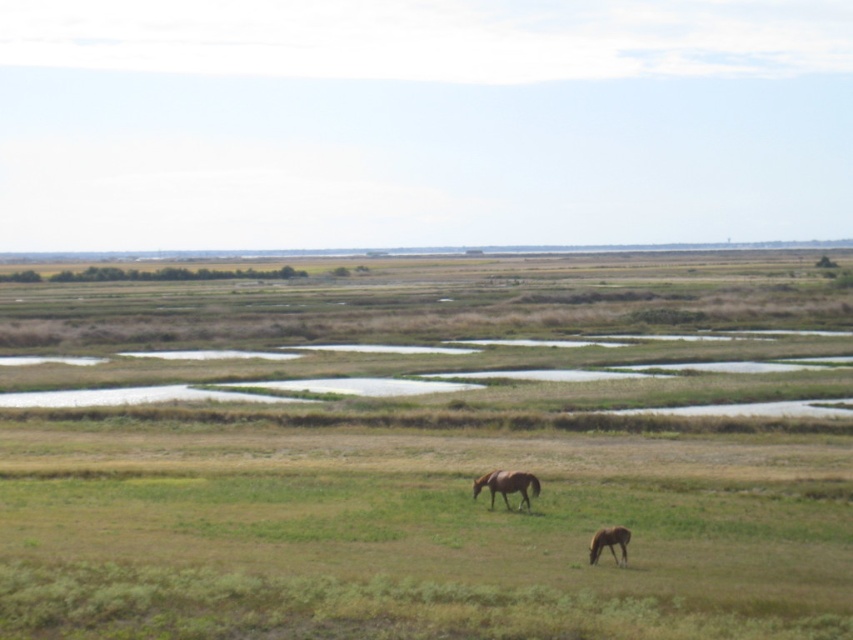
Which is above, brown glossy horse at center or brown glossy horse at lower right?

Positioned higher is brown glossy horse at center.

Does brown glossy horse at center appear under brown glossy horse at lower right?

Actually, brown glossy horse at center is above brown glossy horse at lower right.

Between point (479, 483) and point (618, 540), which one is positioned in front?

Point (618, 540)

Where is `brown glossy horse at center`? brown glossy horse at center is located at coordinates (506, 484).